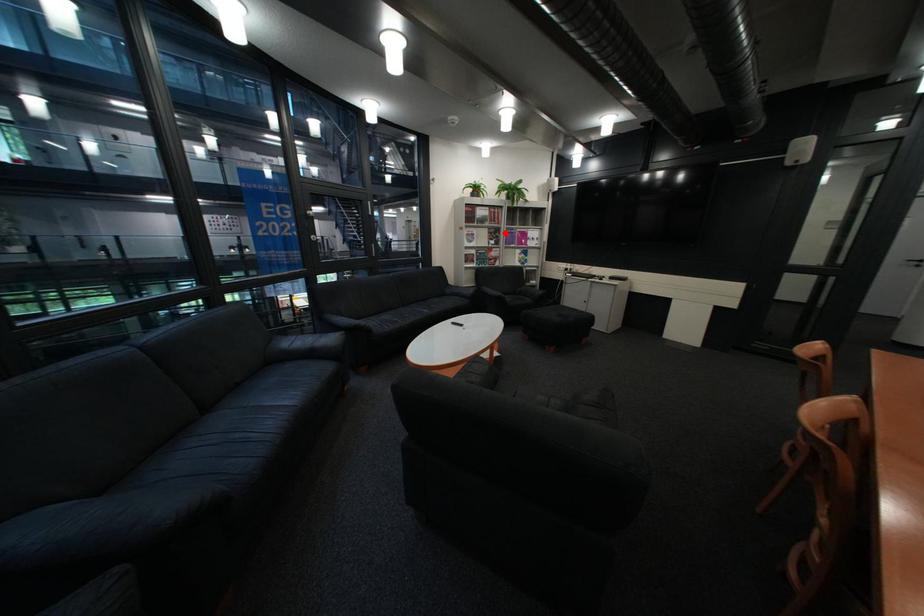
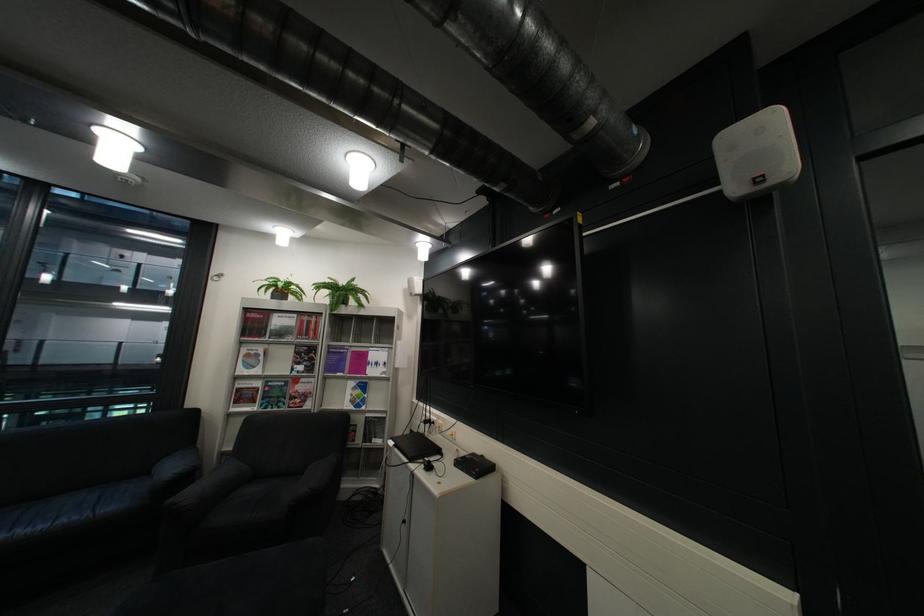
Find the pixel in the second image that matches the highlighted location in the first image.

(311, 353)